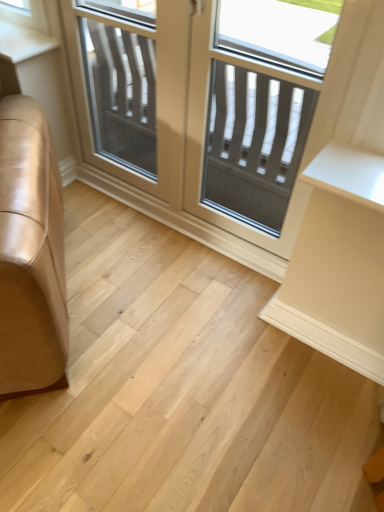
Question: Does clear glass door at center have a greater height compared to matte gray screen door at center, arranged as the first screen door when viewed from the right?

Choices:
 (A) no
 (B) yes

Answer: (B)

Question: Is clear glass door at center to the left of matte gray screen door at center, arranged as the first screen door when viewed from the right, from the viewer's perspective?

Choices:
 (A) no
 (B) yes

Answer: (B)

Question: From a real-world perspective, is clear glass door at center located beneath matte gray screen door at center, arranged as the first screen door when viewed from the right?

Choices:
 (A) yes
 (B) no

Answer: (A)

Question: Is clear glass door at center beside matte gray screen door at center, arranged as the first screen door when viewed from the right?

Choices:
 (A) no
 (B) yes

Answer: (A)

Question: Is clear glass door at center far from matte gray screen door at center, arranged as the first screen door when viewed from the right?

Choices:
 (A) yes
 (B) no

Answer: (B)

Question: Is clear glass door at center wider or thinner than clear glass screen door at center, which ranks as the 1th screen door in left-to-right order?

Choices:
 (A) thin
 (B) wide

Answer: (A)

Question: Looking at the image, does clear glass door at center seem bigger or smaller compared to clear glass screen door at center, placed as the second screen door when sorted from right to left?

Choices:
 (A) big
 (B) small

Answer: (A)

Question: Choose the correct answer: Is clear glass door at center inside clear glass screen door at center, placed as the second screen door when sorted from right to left, or outside it?

Choices:
 (A) inside
 (B) outside

Answer: (A)

Question: Is clear glass door at center in front of or behind clear glass screen door at center, placed as the second screen door when sorted from right to left, in the image?

Choices:
 (A) front
 (B) behind

Answer: (A)

Question: Is clear glass screen door at center, placed as the second screen door when sorted from right to left, situated inside matte gray screen door at center, which is the second screen door in left-to-right order, or outside?

Choices:
 (A) inside
 (B) outside

Answer: (B)

Question: Is clear glass screen door at center, which ranks as the 1th screen door in left-to-right order, taller or shorter than matte gray screen door at center, which is the second screen door in left-to-right order?

Choices:
 (A) short
 (B) tall

Answer: (A)

Question: From the image's perspective, is clear glass screen door at center, placed as the second screen door when sorted from right to left, positioned above or below matte gray screen door at center, arranged as the first screen door when viewed from the right?

Choices:
 (A) above
 (B) below

Answer: (A)

Question: Does point (110, 102) appear closer or farther from the camera than point (213, 75)?

Choices:
 (A) farther
 (B) closer

Answer: (A)

Question: From their relative heights in the image, would you say matte gray screen door at center, arranged as the first screen door when viewed from the right, is taller or shorter than clear glass screen door at center, placed as the second screen door when sorted from right to left?

Choices:
 (A) tall
 (B) short

Answer: (A)

Question: Considering their positions, is matte gray screen door at center, arranged as the first screen door when viewed from the right, located in front of or behind clear glass screen door at center, which ranks as the 1th screen door in left-to-right order?

Choices:
 (A) behind
 (B) front

Answer: (B)